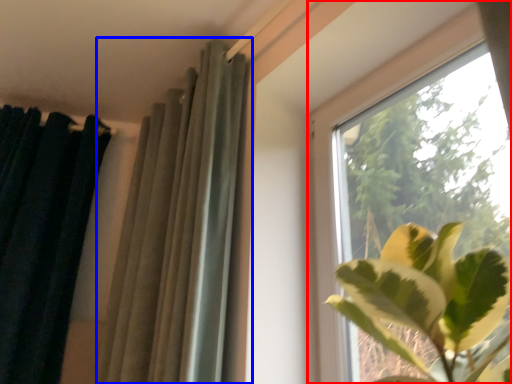
Question: Which point is closer to the camera, window (highlighted by a red box) or curtain (highlighted by a blue box)?

Choices:
 (A) window
 (B) curtain

Answer: (A)